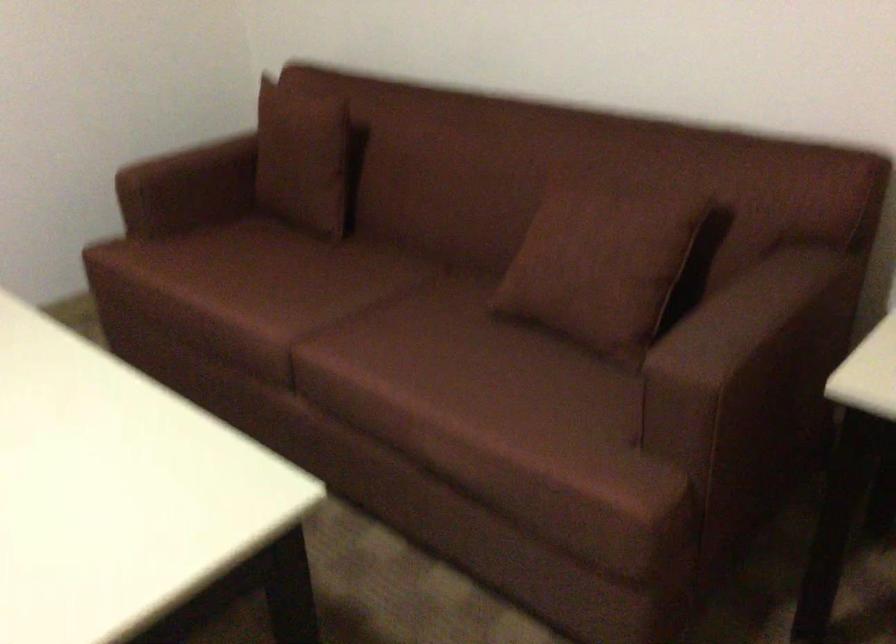
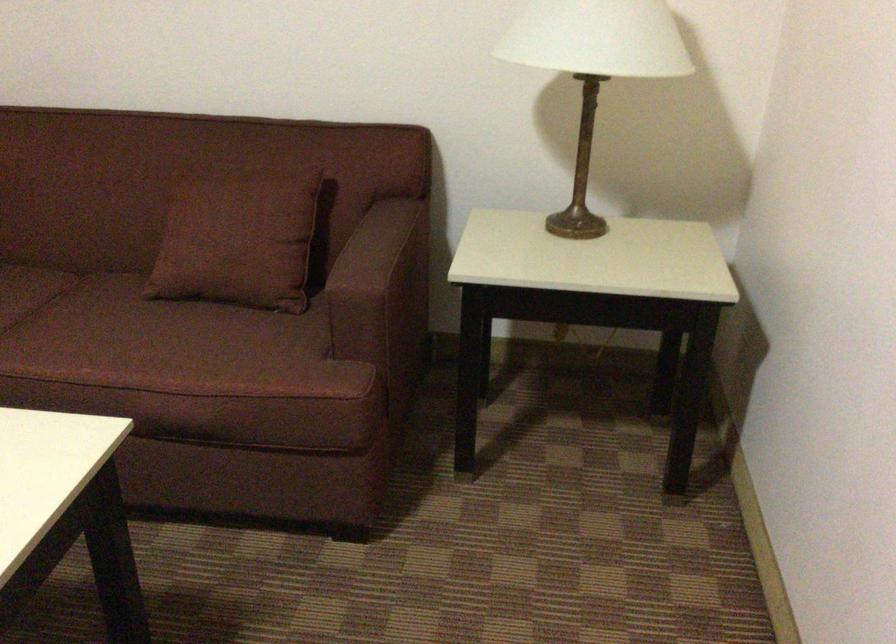
Where in the second image is the point corresponding to the point at 720,325 from the first image?

(367, 254)